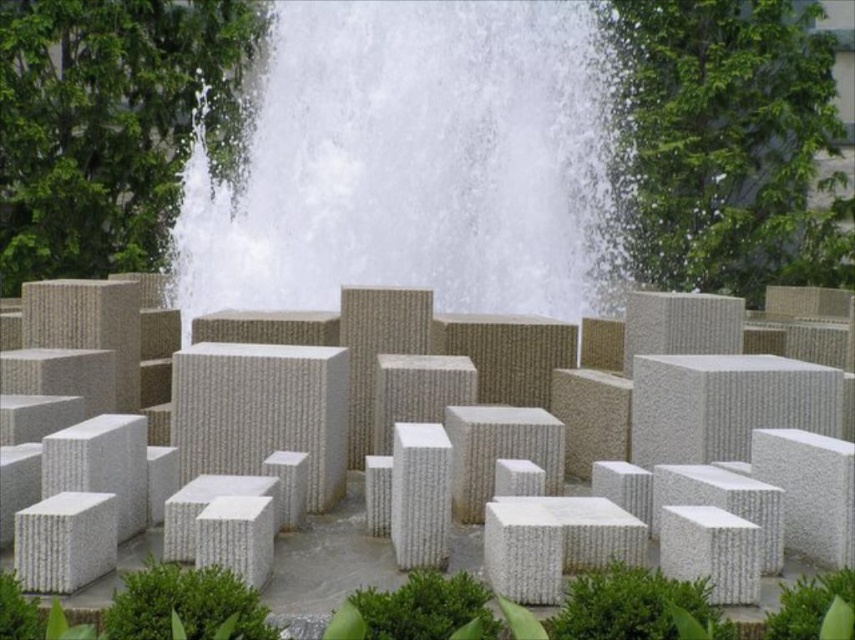
Is white textured water at center positioned before white textured blocks at center?

No, it is not.

Who is higher up, white textured water at center or white textured blocks at center?

white textured water at center is higher up.

Is point (401, 56) in front of point (493, 452)?

No, (401, 56) is behind (493, 452).

Identify the location of white textured water at center. [413, 164].